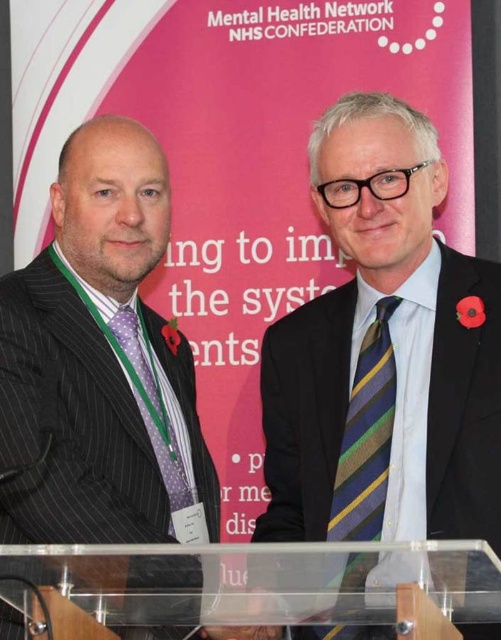
Based on the photo, does striped wool tie at center have a lesser width compared to striped silk tie at center?

No, striped wool tie at center is not thinner than striped silk tie at center.

Does striped wool tie at center have a larger size compared to striped silk tie at center?

Yes, striped wool tie at center is bigger than striped silk tie at center.

What are the coordinates of `striped wool tie at center` in the screenshot? It's located at (304, 413).

Which of these two, striped silk tie at center or polka dot silk tie at left, stands taller?

With more height is polka dot silk tie at left.

Is point (377, 330) farther from viewer compared to point (123, 339)?

No.

Where is `striped silk tie at center`? striped silk tie at center is located at coordinates (367, 436).

Does black pinstripe suit at left appear on the right side of striped silk tie at center?

Incorrect, black pinstripe suit at left is not on the right side of striped silk tie at center.

Between point (36, 531) and point (389, 420), which one is positioned in front?

Point (36, 531) is more forward.

Locate an element on the screen. black pinstripe suit at left is located at coordinates (90, 419).